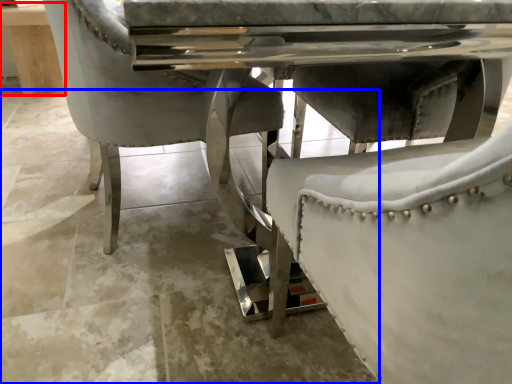
Question: Among these objects, which one is nearest to the camera, table (highlighted by a red box) or concrete (highlighted by a blue box)?

Choices:
 (A) table
 (B) concrete

Answer: (B)